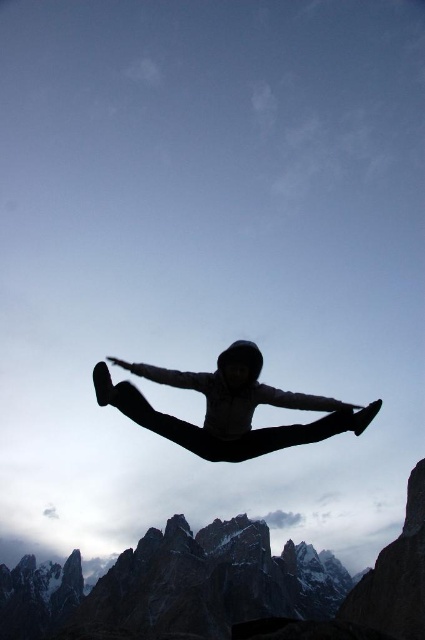
You are a photographer trying to capture the scene with a wide angle lens. Given that the rugged stone mountain at center is the main subject and the black matte person at center is a secondary subject, will the mountain dominate the frame compared to the person?

Yes, the rugged stone mountain at center is larger in size than the black matte person at center, so it will dominate the frame.

You are standing at the base of the mountain and see the silhouette of a person performing a split leap. There is a specific point marked at coordinates point [79,612]. If you want to place a safety net 500 feet away from where you are standing to catch the person, will the safety net be placed closer to or farther away than the point?

The point [79,612] is 550.39 feet away from the viewer. Since the safety net is placed at 500 feet, it will be closer to the viewer than the point.

You are a drone operator tasked with capturing aerial footage of the rugged stone mountain at center and the black matte person at center. Your drone has a maximum flight range of 200 feet. Can you fly your drone from the person to the mountain without exceeding its range?

The distance between rugged stone mountain at center and black matte person at center is 224.90 feet, which exceeds the drone maximum flight range of 200 feet. Therefore, the drone cannot reach the rugged stone mountain at center from the black matte person at center without exceeding its range.